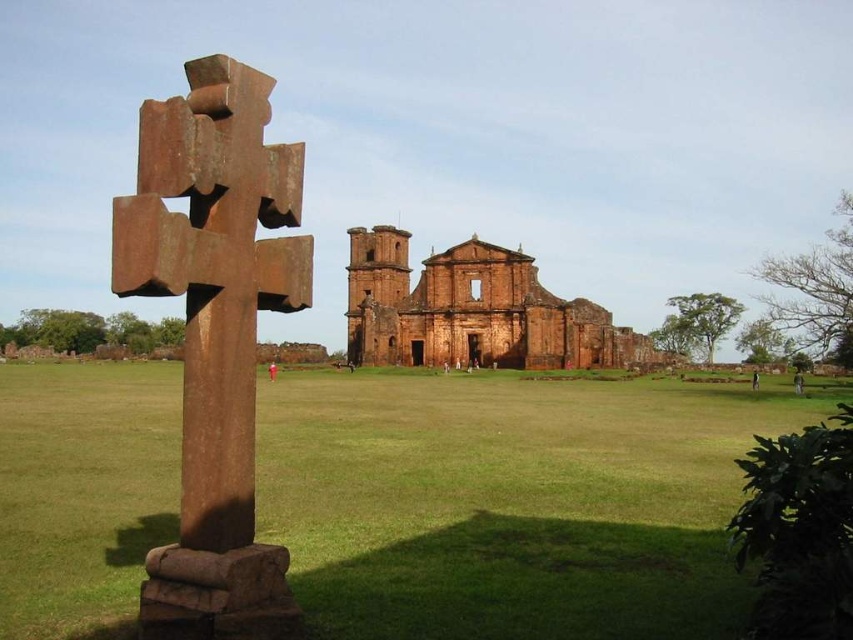
You are standing in front of the rusty metal cross at left and want to walk towards the brown brick ruins at center. Which direction should you move to get closer to the ruins?

Since the rusty metal cross at left is closer to the viewer than the brown brick ruins at center, you should move forward towards the center of the image to get closer to the brown brick ruins at center.

You are standing in front of the large stone cross and want to move towards the grand stone building in the background. Which point, point (732, 602) or point (213, 422), is closer to your current position?

Point (732, 602) is closer to your current position because it is further to the viewer than point (213, 422).

You are a gardener who wants to plant flowers in the area between the green grass at center and the brown brick ruins at center. Which area has a wider space for planting?

The green grass at center has a wider space for planting than the brown brick ruins at center because its width surpasses the latter.